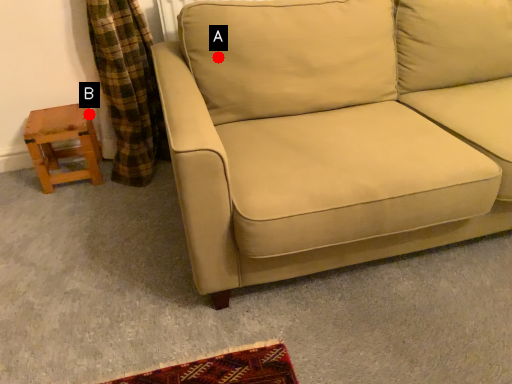
Question: Two points are circled on the image, labeled by A and B beside each circle. Which point appears farthest from the camera in this image?

Choices:
 (A) A is further
 (B) B is further

Answer: (B)